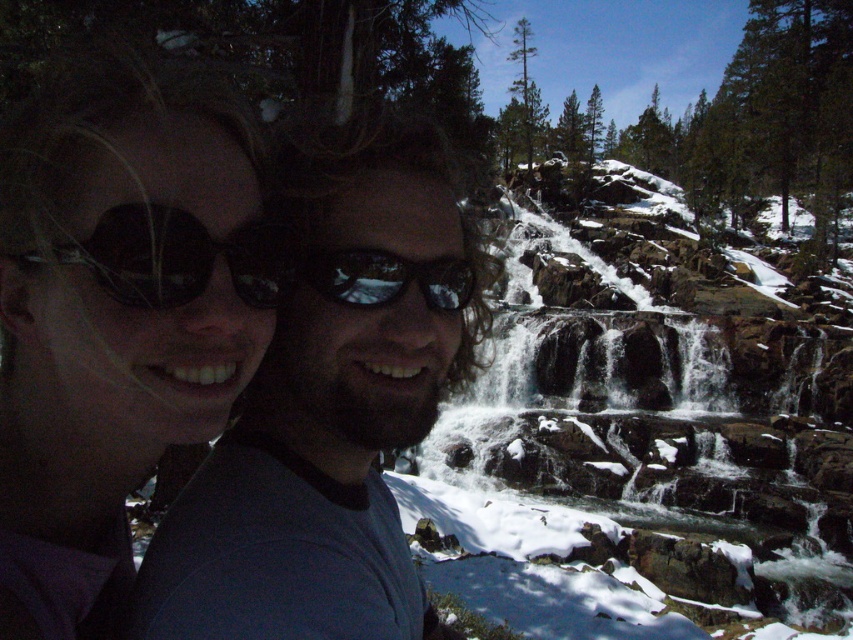
Question: Based on their relative distances, which object is nearer to the black reflective sunglasses at center?

Choices:
 (A) black reflective sunglasses at left
 (B) matte black sunglasses at upper left

Answer: (A)

Question: Which object appears closest to the camera in this image?

Choices:
 (A) matte black sunglasses at upper left
 (B) black reflective sunglasses at center
 (C) matte black sunglasses at center

Answer: (A)

Question: Can you confirm if black reflective sunglasses at left is positioned above black reflective sunglasses at center?

Choices:
 (A) no
 (B) yes

Answer: (B)

Question: Does matte black sunglasses at upper left have a greater width compared to matte black sunglasses at center?

Choices:
 (A) no
 (B) yes

Answer: (A)

Question: Can you confirm if black reflective sunglasses at left is bigger than black reflective sunglasses at center?

Choices:
 (A) yes
 (B) no

Answer: (A)

Question: Considering the real-world distances, which object is farthest from the matte black sunglasses at center?

Choices:
 (A) black reflective sunglasses at center
 (B) matte black sunglasses at upper left
 (C) black reflective sunglasses at left

Answer: (C)